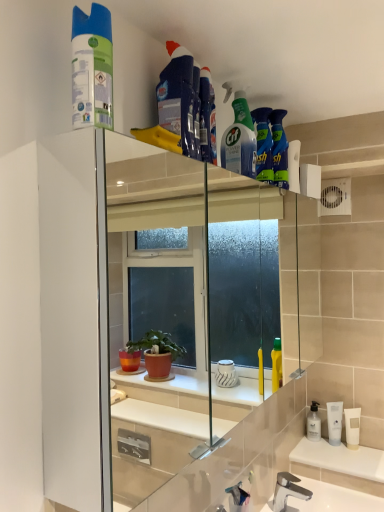
Question: Is blue glossy bottle at upper center, which is the fifth cleaning product from front to back, looking in the opposite direction of blue fabric cleaning product at upper center, which is counted as the 3th cleaning product, starting from the right?

Choices:
 (A) yes
 (B) no

Answer: (B)

Question: Is blue glossy bottle at upper center, which is the fifth cleaning product from front to back, not inside blue fabric cleaning product at upper center, which is the third cleaning product from left to right?

Choices:
 (A) no
 (B) yes

Answer: (B)

Question: Is blue glossy bottle at upper center, marked as the first cleaning product in a right-to-left arrangement, bigger than blue fabric cleaning product at upper center, which ranks as the third cleaning product in front-to-back order?

Choices:
 (A) yes
 (B) no

Answer: (A)

Question: Considering the relative sizes of blue glossy bottle at upper center, marked as the first cleaning product in a right-to-left arrangement, and blue fabric cleaning product at upper center, which is counted as the 3th cleaning product, starting from the right, in the image provided, is blue glossy bottle at upper center, marked as the first cleaning product in a right-to-left arrangement, thinner than blue fabric cleaning product at upper center, which is counted as the 3th cleaning product, starting from the right,?

Choices:
 (A) no
 (B) yes

Answer: (A)

Question: From the image's perspective, is blue glossy bottle at upper center, the 5th cleaning product when ordered from left to right, beneath blue fabric cleaning product at upper center, which ranks as the third cleaning product in front-to-back order?

Choices:
 (A) yes
 (B) no

Answer: (A)

Question: From a real-world perspective, does blue glossy bottle at upper center, the 5th cleaning product when ordered from left to right, sit lower than blue fabric cleaning product at upper center, which ranks as the third cleaning product in front-to-back order?

Choices:
 (A) yes
 (B) no

Answer: (A)

Question: Is green matte spray bottle at upper center, acting as the fourth cleaning product starting from the front, at the back of blue glossy bottle at upper center, marked as the first cleaning product in a right-to-left arrangement?

Choices:
 (A) no
 (B) yes

Answer: (A)

Question: Does blue glossy bottle at upper center, marked as the first cleaning product in a right-to-left arrangement, have a lesser width compared to green matte spray bottle at upper center, the 2th cleaning product positioned from the right?

Choices:
 (A) no
 (B) yes

Answer: (B)

Question: Can you confirm if blue glossy bottle at upper center, which is the fifth cleaning product from front to back, is shorter than green matte spray bottle at upper center, positioned as the fourth cleaning product in left-to-right order?

Choices:
 (A) no
 (B) yes

Answer: (B)

Question: Is blue glossy bottle at upper center, which is the fifth cleaning product from front to back, at the left side of green matte spray bottle at upper center, positioned as the fourth cleaning product in left-to-right order?

Choices:
 (A) yes
 (B) no

Answer: (B)

Question: Is blue glossy bottle at upper center, the first cleaning product positioned from the back, at the right side of green matte spray bottle at upper center, the 2th cleaning product positioned from the right?

Choices:
 (A) no
 (B) yes

Answer: (B)

Question: From a real-world perspective, does blue glossy bottle at upper center, the first cleaning product positioned from the back, sit lower than green matte spray bottle at upper center, acting as the fourth cleaning product starting from the front?

Choices:
 (A) no
 (B) yes

Answer: (B)

Question: From the image's perspective, is green matte spray can at upper left, marked as the 5th cleaning product in a back-to-front arrangement, below blue fabric cleaning product at upper center, marked as the 4th cleaning product in a right-to-left arrangement?

Choices:
 (A) yes
 (B) no

Answer: (A)